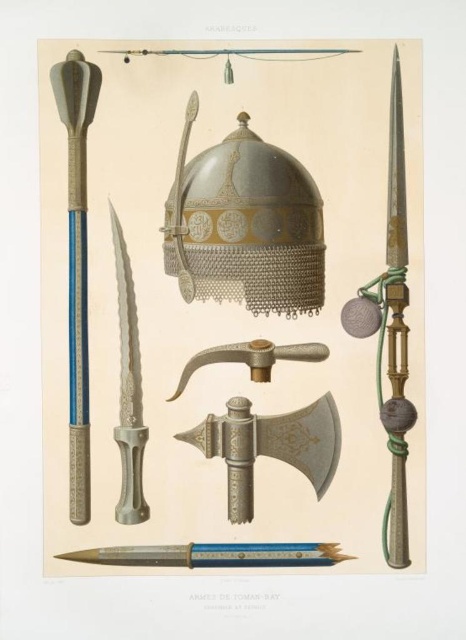
You are an archaeologist examining two items in the image. You need to determine which object is taller between the metallic chainmail helmet at center and the polished silver dagger at center. Based on the scene, which one is taller?

The metallic chainmail helmet at center is much taller than the polished silver dagger at center, so the metallic chainmail helmet at center is taller.